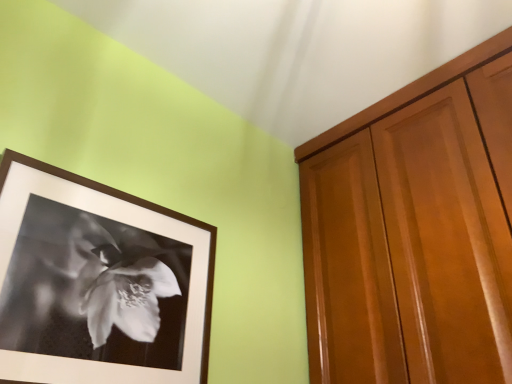
Question: Is black matte picture frame at upper left inside the boundaries of glossy wood cabinetry at right, or outside?

Choices:
 (A) inside
 (B) outside

Answer: (B)

Question: Looking at the image, does black matte picture frame at upper left seem bigger or smaller compared to glossy wood cabinetry at right?

Choices:
 (A) small
 (B) big

Answer: (A)

Question: Considering their positions, is black matte picture frame at upper left located in front of or behind glossy wood cabinetry at right?

Choices:
 (A) front
 (B) behind

Answer: (A)

Question: Is point (326, 226) positioned closer to the camera than point (6, 162)?

Choices:
 (A) closer
 (B) farther

Answer: (B)

Question: Considering their positions, is glossy wood cabinetry at right located in front of or behind black matte picture frame at upper left?

Choices:
 (A) front
 (B) behind

Answer: (B)

Question: In terms of height, does glossy wood cabinetry at right look taller or shorter compared to black matte picture frame at upper left?

Choices:
 (A) tall
 (B) short

Answer: (A)

Question: Considering the positions of glossy wood cabinetry at right and black matte picture frame at upper left in the image, is glossy wood cabinetry at right wider or thinner than black matte picture frame at upper left?

Choices:
 (A) thin
 (B) wide

Answer: (B)